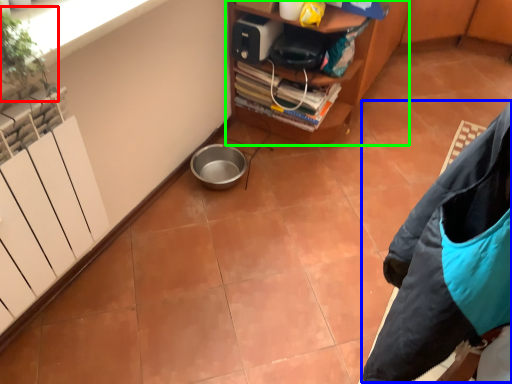
Question: Which object is the closest to the plant (highlighted by a red box)? Choose among these: jacket (highlighted by a blue box) or furniture (highlighted by a green box).

Choices:
 (A) jacket
 (B) furniture

Answer: (A)